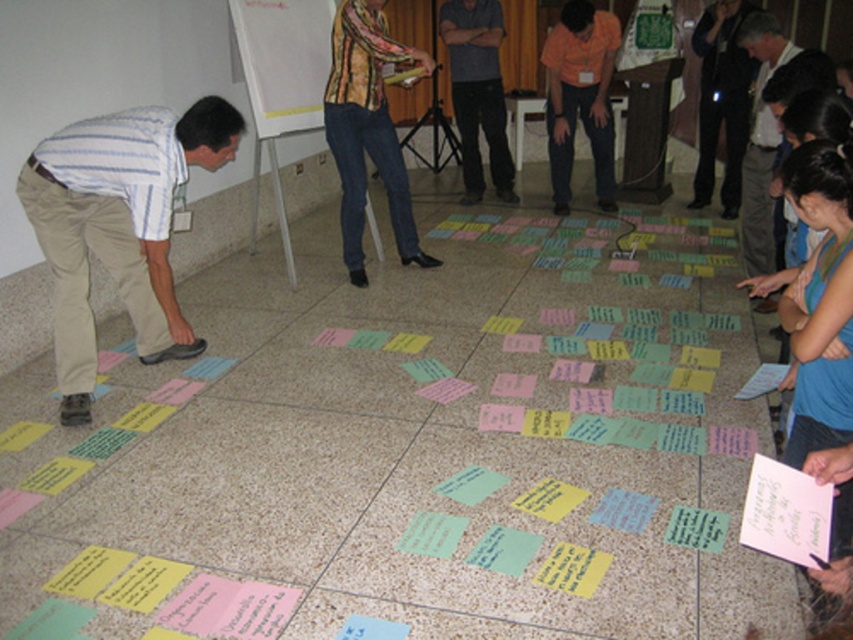
Is striped cotton shirt at center positioned before orange shirt at center?

That is True.

Where is `striped cotton shirt at center`? striped cotton shirt at center is located at coordinates (368, 129).

Identify the location of striped cotton shirt at center. (368, 129).

Looking at this image, between khaki cotton pants at lower left and wooden whiteboard at upper center, which one is positioned higher?

wooden whiteboard at upper center

Who is more forward, (57,147) or (259,72)?

Point (57,147) is more forward.

Is point (53, 257) closer to camera compared to point (251, 77)?

Yes.

Locate an element on the screen. khaki cotton pants at lower left is located at coordinates (119, 227).

Does khaki cotton pants at lower left have a larger size compared to dark gray shirt at center?

Correct, khaki cotton pants at lower left is larger in size than dark gray shirt at center.

At what (x,y) coordinates should I click in order to perform the action: click on khaki cotton pants at lower left. Please return your answer as a coordinate pair (x, y). The image size is (853, 640). Looking at the image, I should click on (119, 227).

Where is `khaki cotton pants at lower left`? The height and width of the screenshot is (640, 853). khaki cotton pants at lower left is located at coordinates (119, 227).

Where is `khaki cotton pants at lower left`? Image resolution: width=853 pixels, height=640 pixels. khaki cotton pants at lower left is located at coordinates (119, 227).